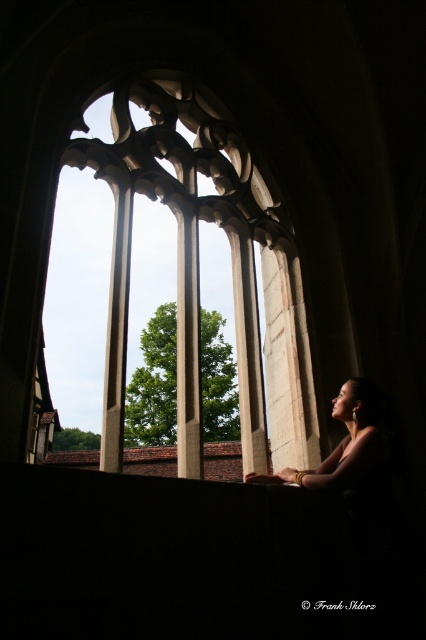
Question: Is white stone window at center below smooth skin woman at center?

Choices:
 (A) no
 (B) yes

Answer: (A)

Question: Can you confirm if white stone window at center is smaller than smooth skin woman at center?

Choices:
 (A) no
 (B) yes

Answer: (A)

Question: Can you confirm if white stone window at center is positioned below smooth skin woman at center?

Choices:
 (A) yes
 (B) no

Answer: (B)

Question: Which of the following is the farthest from the observer?

Choices:
 (A) smooth skin woman at center
 (B) white stone window at center

Answer: (A)

Question: Which point appears farthest from the camera in this image?

Choices:
 (A) (371, 422)
 (B) (216, 189)

Answer: (B)